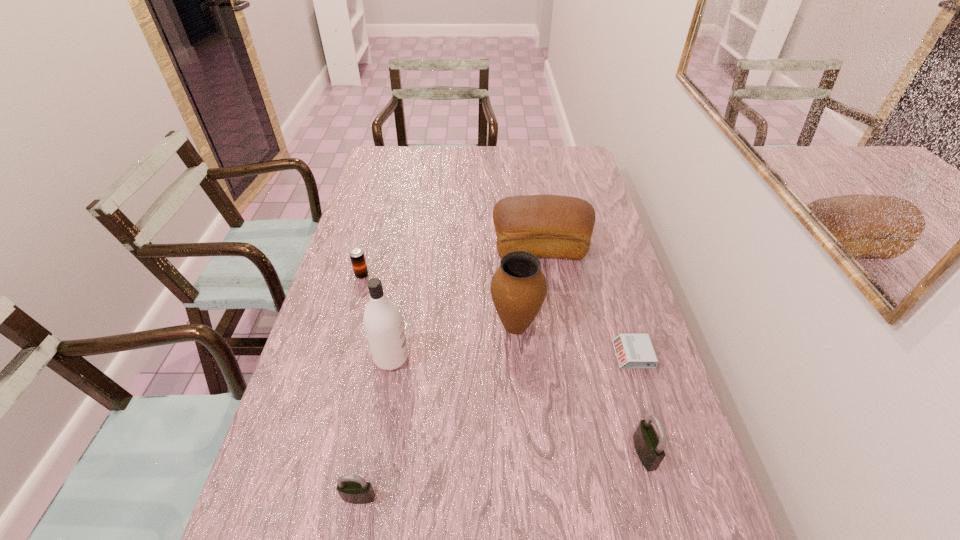
At what (x,y) coordinates should I click in order to perform the action: click on vacant space that satisfies the following two spatial constraints: 1. on the back side of the farther padlock; 2. on the front-facing side of the tallest object. Please return your answer as a coordinate pair (x, y). The width and height of the screenshot is (960, 540). Looking at the image, I should click on (618, 358).